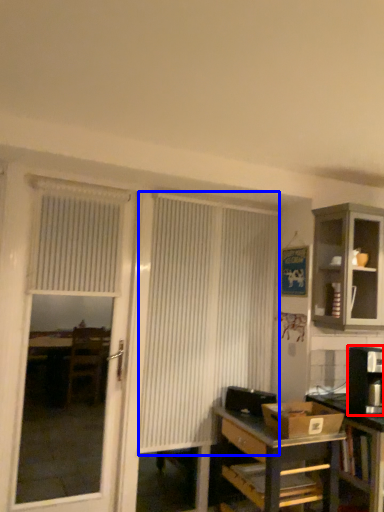
Question: Which object is further to the camera taking this photo, appliance (highlighted by a red box) or curtain (highlighted by a blue box)?

Choices:
 (A) appliance
 (B) curtain

Answer: (B)